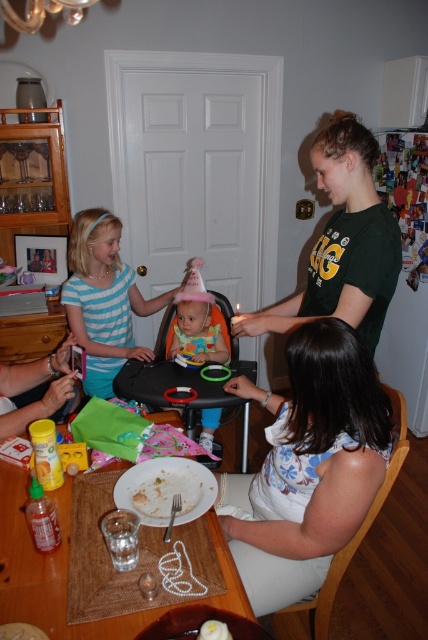
From the picture: You are a photographer setting up for a birthday photo. You want to position the green cotton shirt at upper right and the striped fabric dress at center so they are closer together. Given their current distance, is this adjustment feasible?

The green cotton shirt at upper right and striped fabric dress at center are currently 36.60 inches apart. Moving them closer would require reducing this distance, which is feasible as long as there is enough space available in the scene to adjust their positions without obstruction.

You are standing in the dining area and want to locate the green cotton shirt at upper right. Which direction should you look to find it?

The green cotton shirt at upper right is located at the upper right direction from your current position in the dining area.